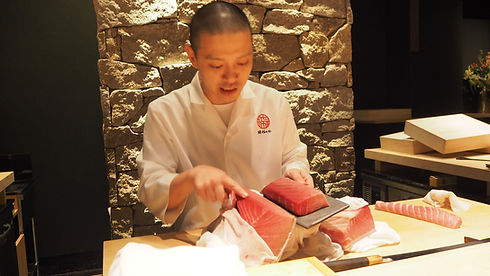
The image size is (490, 276). What are the coordinates of `yellow table` in the screenshot? It's located at (434, 231).